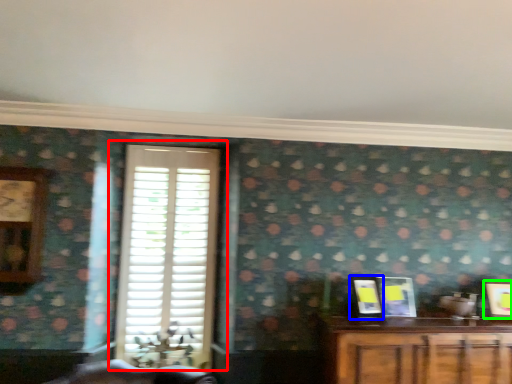
Question: Considering the real-world distances, which object is closest to window (highlighted by a red box)? picture frame (highlighted by a blue box) or picture frame (highlighted by a green box).

Choices:
 (A) picture frame
 (B) picture frame

Answer: (A)